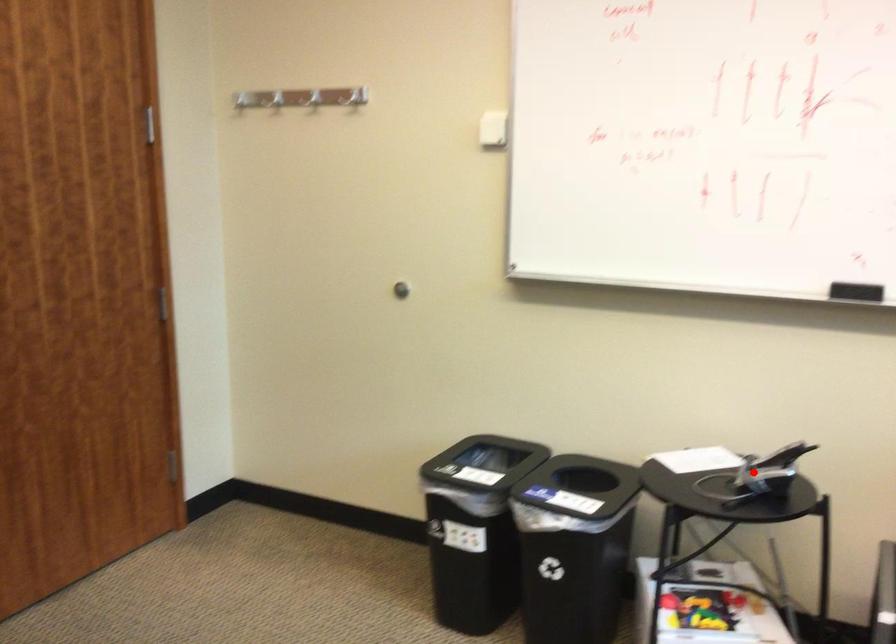
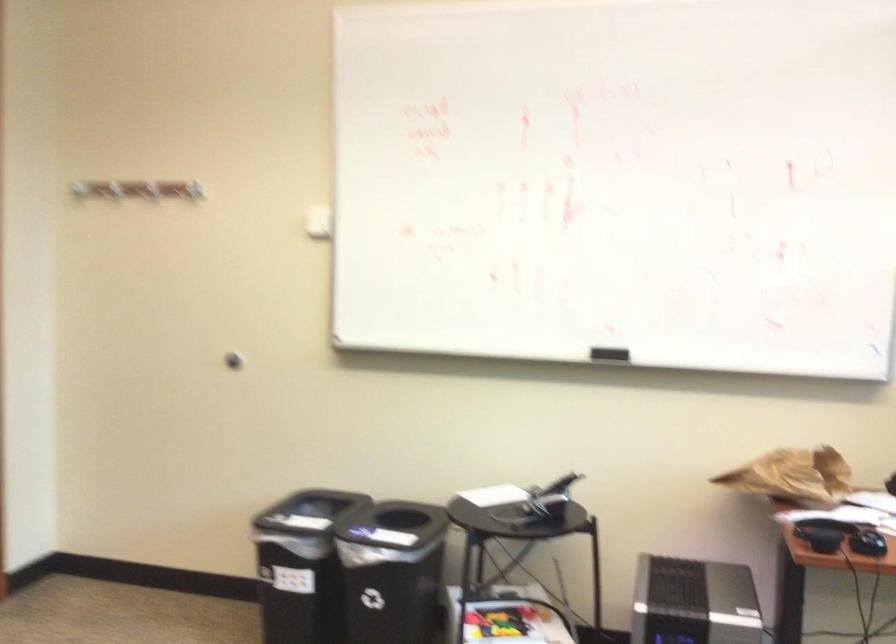
Find the pixel in the second image that matches the highlighted location in the first image.

(539, 503)